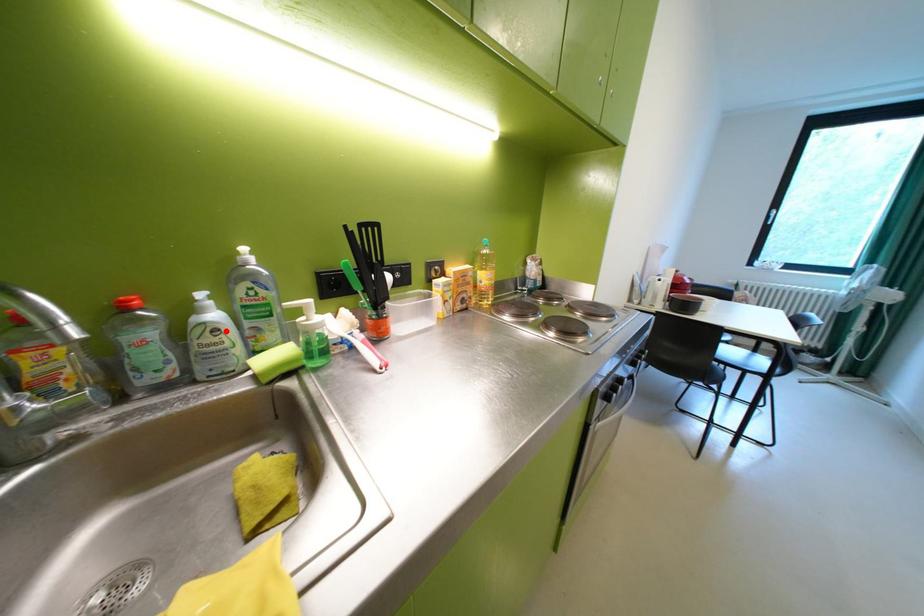
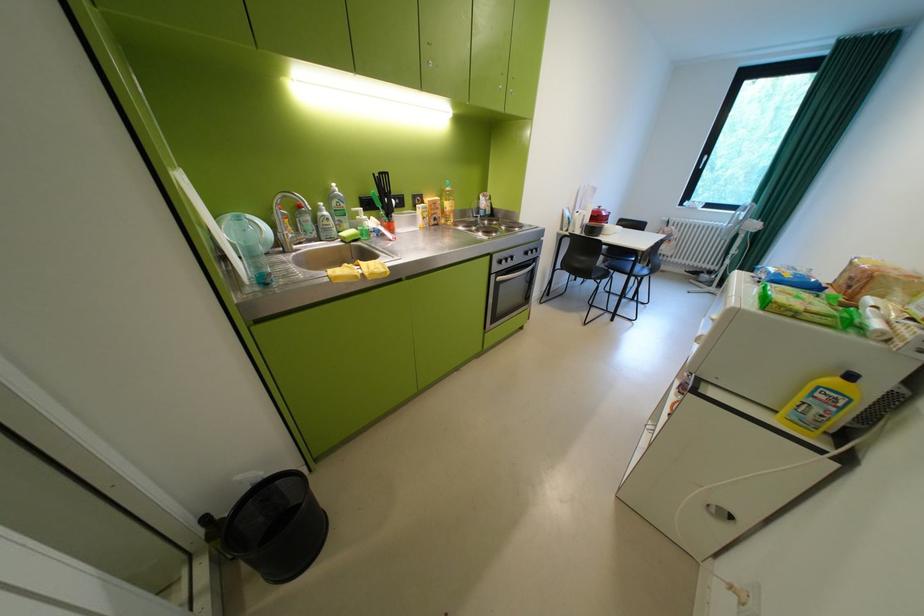
The point at the highlighted location is marked in the first image. Where is the corresponding point in the second image?

(338, 220)